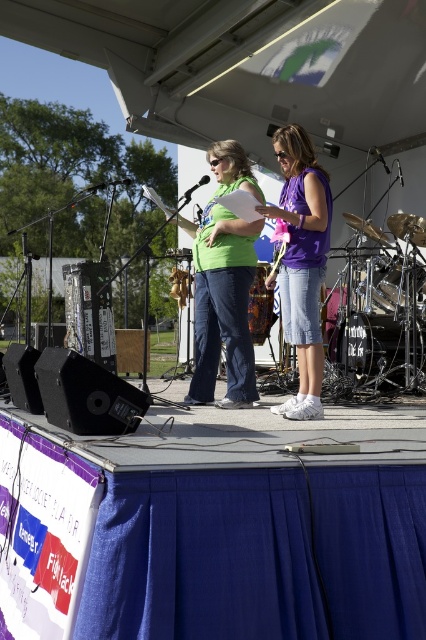
Question: Which point is farther from the camera taking this photo?

Choices:
 (A) (212, 300)
 (B) (313, 160)

Answer: (A)

Question: Which point appears farthest from the camera in this image?

Choices:
 (A) (316, 221)
 (B) (227, 310)

Answer: (B)

Question: Is matte green shirt at center closer to the viewer compared to purple cotton shirt at center?

Choices:
 (A) no
 (B) yes

Answer: (A)

Question: Does matte green shirt at center appear on the right side of purple cotton shirt at center?

Choices:
 (A) no
 (B) yes

Answer: (A)

Question: Does matte green shirt at center have a greater width compared to purple cotton shirt at center?

Choices:
 (A) no
 (B) yes

Answer: (B)